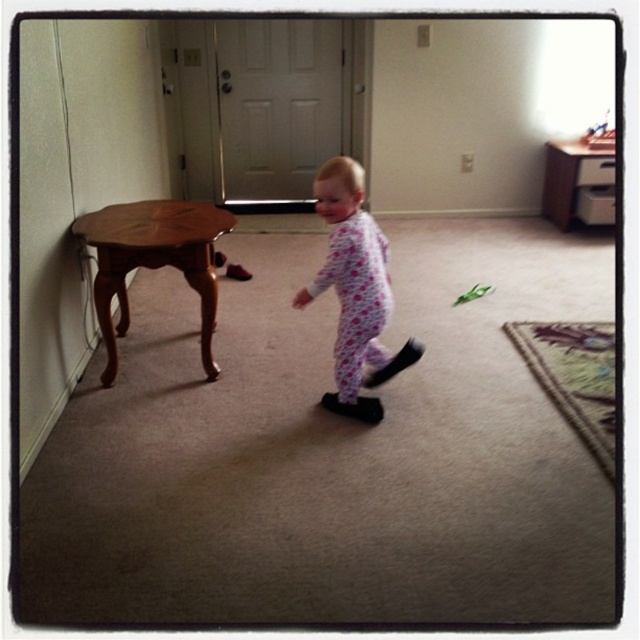
Which is behind, point (371, 289) or point (84, 230)?

Point (84, 230)

Which is above, fluffy pink pajamas at center or wooden stool at left?

wooden stool at left is higher up.

Describe the element at coordinates (355, 291) in the screenshot. The image size is (640, 640). I see `fluffy pink pajamas at center` at that location.

What are the coordinates of `fluffy pink pajamas at center` in the screenshot? It's located at (355, 291).

This screenshot has height=640, width=640. I want to click on wooden stool at left, so click(x=152, y=260).

Which is behind, point (88, 214) or point (468, 298)?

Point (468, 298)

Is point (212, 209) more distant than point (464, 296)?

No, (212, 209) is in front of (464, 296).

Where is `wooden stool at left`? This screenshot has width=640, height=640. wooden stool at left is located at coordinates (152, 260).

Does fluffy pink pajamas at center have a lesser height compared to green plastic toy at center?

In fact, fluffy pink pajamas at center may be taller than green plastic toy at center.

Is fluffy pink pajamas at center to the right of green plastic toy at center from the viewer's perspective?

In fact, fluffy pink pajamas at center is to the left of green plastic toy at center.

Is point (369, 285) positioned in front of point (474, 292)?

Yes, point (369, 285) is closer to viewer.

I want to click on fluffy pink pajamas at center, so click(x=355, y=291).